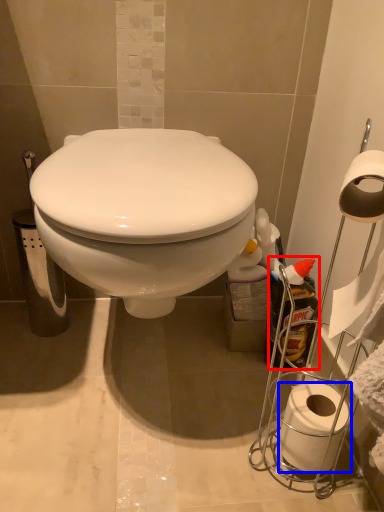
Question: Which object is closer to the camera taking this photo, cleaning product (highlighted by a red box) or toilet paper (highlighted by a blue box)?

Choices:
 (A) cleaning product
 (B) toilet paper

Answer: (B)